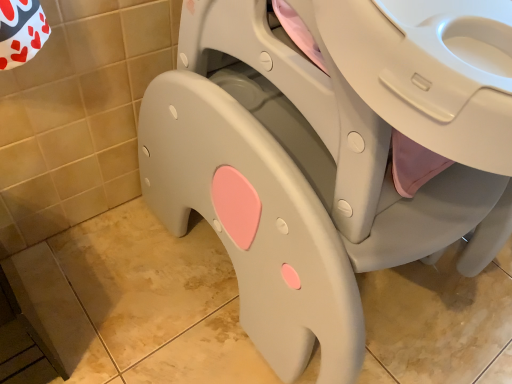
Describe the element at coordinates (328, 157) in the screenshot. I see `matte plastic toilet at center` at that location.

What is the approximate width of matte plastic toilet at center?

It is 28.62 inches.

This screenshot has width=512, height=384. I want to click on matte plastic toilet at center, so click(x=328, y=157).

Locate an element on the screen. This screenshot has height=384, width=512. matte plastic toilet at center is located at coordinates (328, 157).